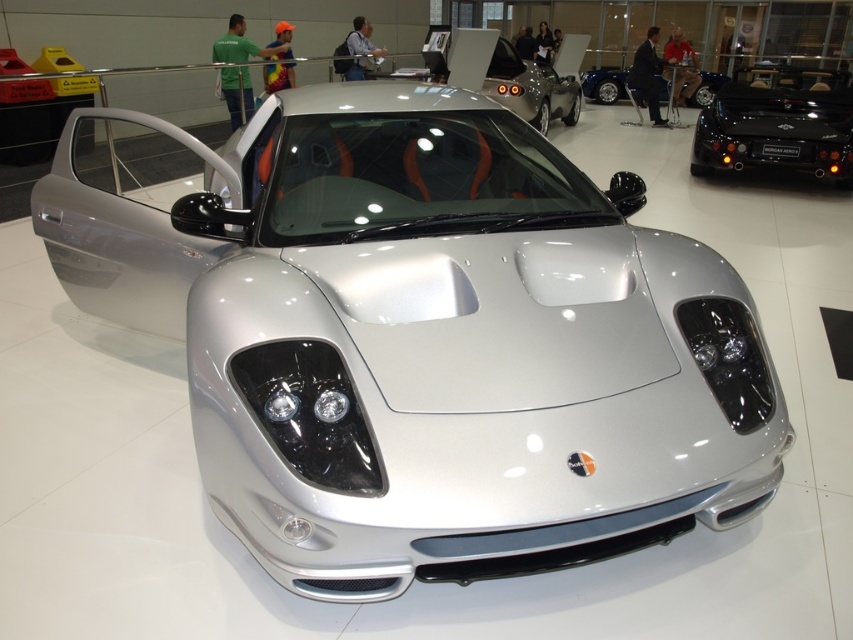
You are a photographer at an auto show and need to capture both the silver metallic car at center and the black glossy morgan aero at right in a single frame. Given that your camera has a fixed focal length and limited field of view, which car should you position closer to the camera to ensure both fit in the frame without cropping?

The silver metallic car at center is bigger than the black glossy morgan aero at right. To ensure both fit in the frame without cropping, you should position the silver metallic car at center closer to the camera. This way, its larger size can be accommodated within the limited field of view while still capturing the smaller black glossy morgan aero at right in the background.

You are an engineer inspecting the car and need to access both the point at coordinate (767, 72) and the point at coordinate (445, 38). Which point should you reach first to minimize your movement?

You should reach the point at coordinate (767, 72) first because it is closer to you than the point at coordinate (445, 38).

You are standing at the entrance of an auto show and want to take a photo of the silver metallic sports car at center. If your camera has a maximum focus range of 10 meters, will it be able to capture the car clearly?

The silver metallic sports car at center is 9.01 meters away from the camera. Since the camera can focus up to 10 meters, it will be able to capture the car clearly within its maximum focus range.